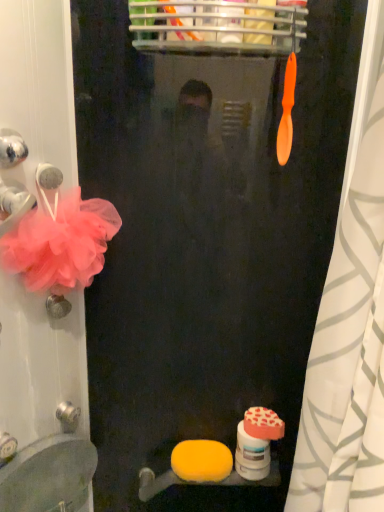
Question: In terms of height, does white matte toilet paper at lower center look taller or shorter compared to yellow sponge at lower center, which appears as the second soap when viewed from the right?

Choices:
 (A) tall
 (B) short

Answer: (A)

Question: In terms of width, does white matte toilet paper at lower center look wider or thinner when compared to yellow sponge at lower center, arranged as the second soap when viewed from the top?

Choices:
 (A) wide
 (B) thin

Answer: (B)

Question: Which object is the closest to the orange plastic toothbrush at upper center?

Choices:
 (A) orange matte shower curtain at right
 (B) white matte toilet paper at lower center
 (C) pink tulle flower at left
 (D) matte white sink at lower left
 (E) orange matte heart-shaped soap at lower right, positioned as the 2th soap in bottom-to-top order

Answer: (A)

Question: Estimate the real-world distances between objects in this image. Which object is farther from the white matte toilet paper at lower center?

Choices:
 (A) pink tulle flower at left
 (B) orange plastic toothbrush at upper center
 (C) matte white sink at lower left
 (D) orange matte shower curtain at right
 (E) yellow sponge at lower center, which is the first soap in bottom-to-top order

Answer: (B)